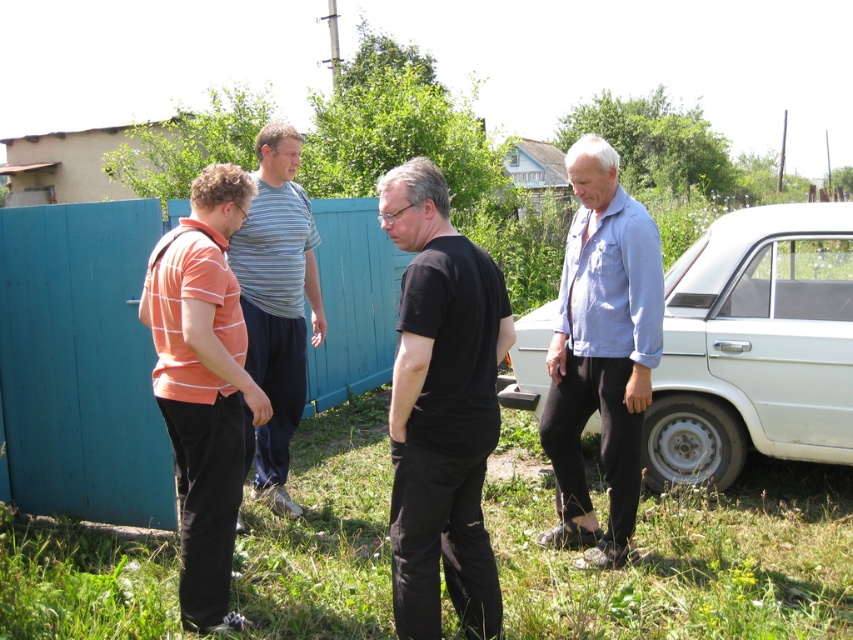
Does point (596, 237) lie behind point (305, 250)?

No.

Between point (581, 417) and point (254, 196), which one is positioned in front?

Point (581, 417) is in front.

Identify the location of blue denim shirt at right. (601, 353).

Which is below, black matte shirt at center or orange striped shirt at left?

Positioned lower is black matte shirt at center.

Who is positioned more to the left, black matte shirt at center or orange striped shirt at left?

From the viewer's perspective, orange striped shirt at left appears more on the left side.

I want to click on black matte shirt at center, so pos(440,408).

Based on the photo, which is below, black matte shirt at center or striped cotton shirt at center?

black matte shirt at center

Is point (404, 556) positioned behind point (270, 346)?

No, it is not.

The image size is (853, 640). I want to click on black matte shirt at center, so click(x=440, y=408).